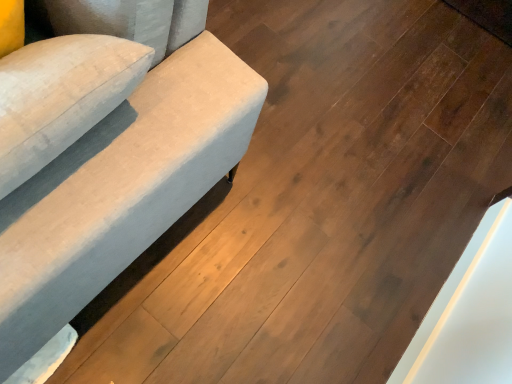
Question: Should I look upward or downward to see velvet beige sofa at left?

Choices:
 (A) down
 (B) up

Answer: (B)